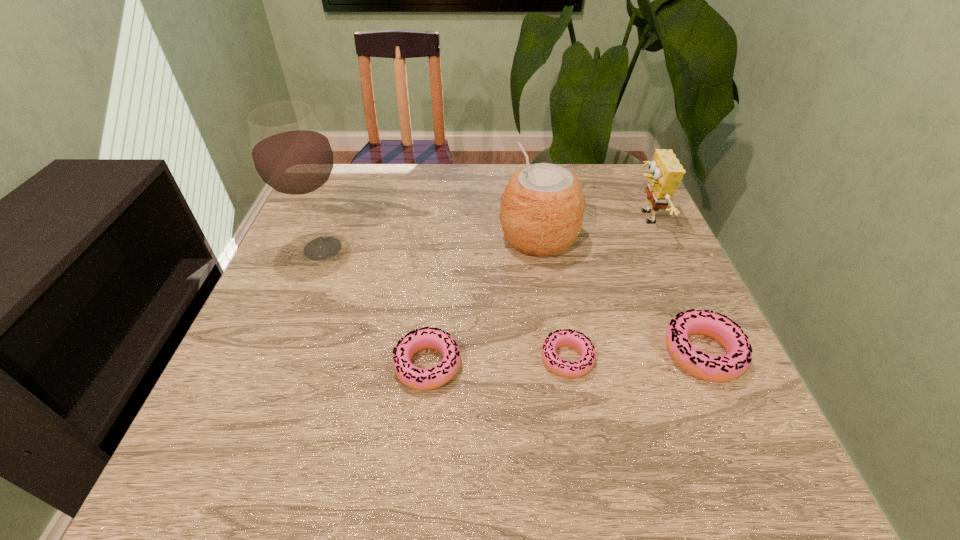
The image size is (960, 540). In order to click on the second shortest object in this screenshot , I will do `click(413, 377)`.

You are a GUI agent. You are given a task and a screenshot of the screen. Output one action in this format:
    pyautogui.click(x=<x>, y=<y>)
    Task: Click on the leftmost doughnut
    
    Given the screenshot: What is the action you would take?
    pyautogui.click(x=413, y=377)

Find the location of a particular element. the shortest doughnut is located at coordinates (x=577, y=340).

Identify the location of the shortest object. The image size is (960, 540). (577, 340).

Locate an element on the screen. The image size is (960, 540). the tallest doughnut is located at coordinates (723, 368).

Identify the location of the third shortest object. (723, 368).

Where is `the fifth shortest object`? the fifth shortest object is located at coordinates (542, 207).

At what (x,y) coordinates should I click in order to perform the action: click on the fourth shortest object. Please return your answer as a coordinate pair (x, y). Looking at the image, I should click on (666, 172).

Image resolution: width=960 pixels, height=540 pixels. Find the location of `the tallest object`. the tallest object is located at coordinates (291, 154).

Locate an element on the screen. This screenshot has width=960, height=540. alcohol is located at coordinates (291, 154).